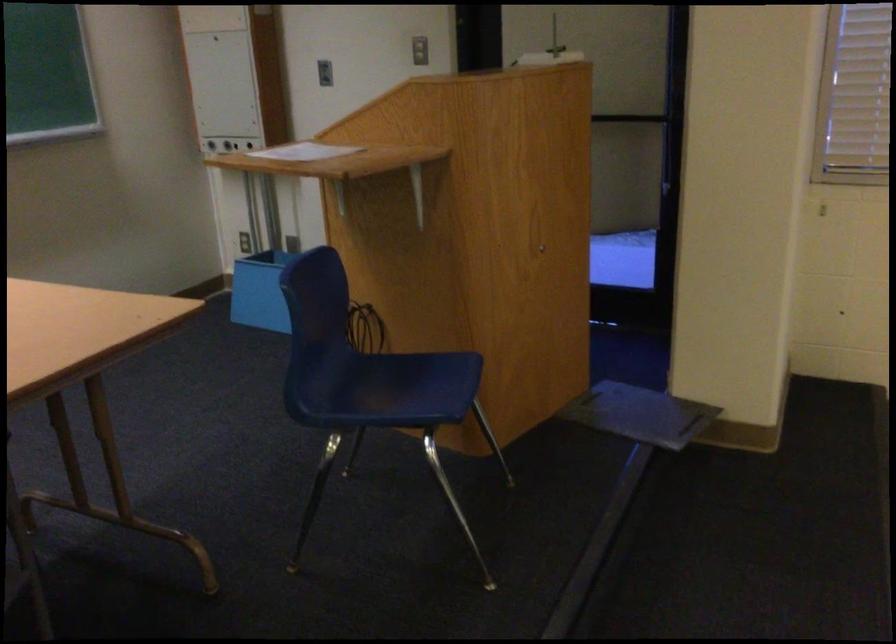
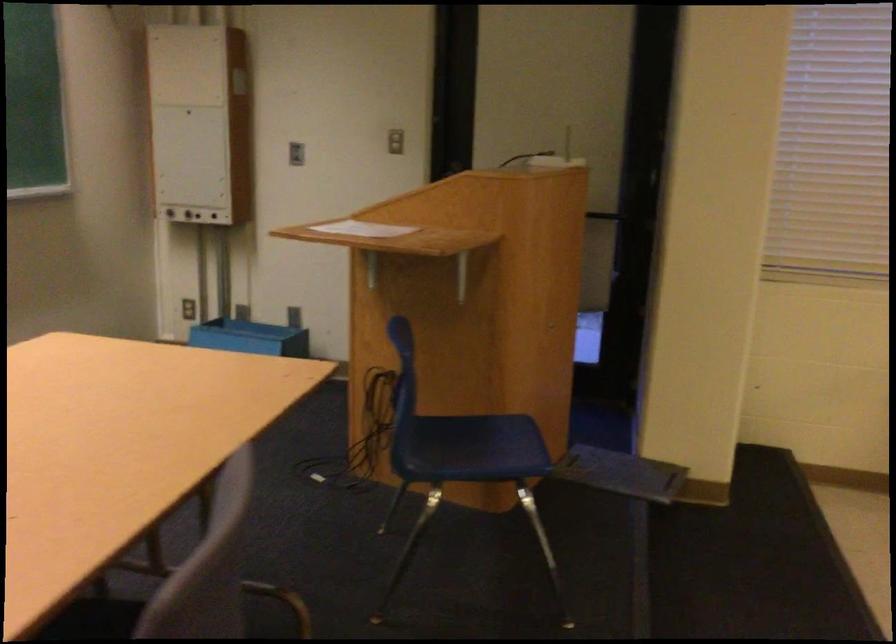
Where in the second image is the point corresponding to the point at 203,143 from the first image?

(167, 210)